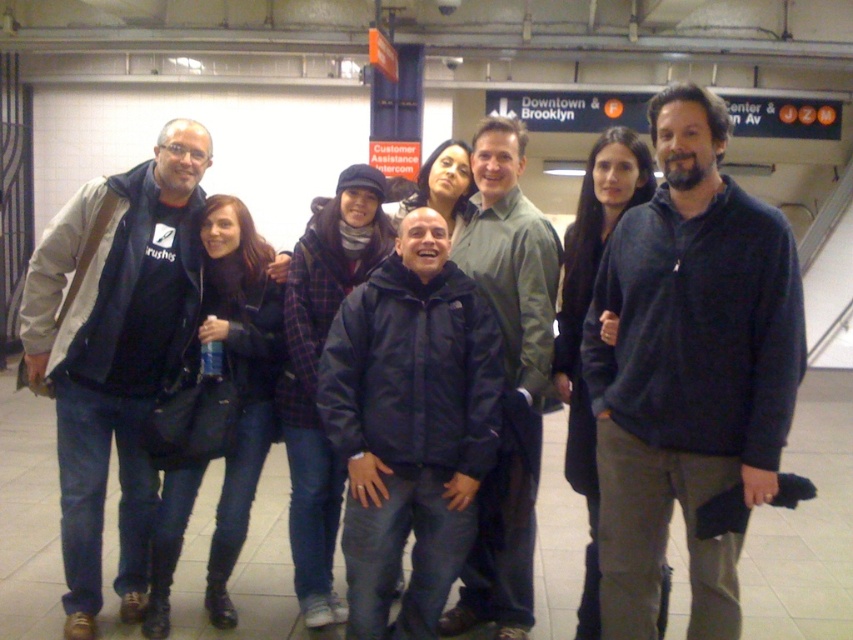
You are a photographer trying to capture a clear shot of both the dark blue fleece at center and the dark blue jacket at center in the subway station. Since you want to ensure both are visible, which one should you focus on first considering their sizes?

The dark blue fleece at center is larger in size than the dark blue jacket at center, so you should focus on the dark blue fleece at center first to ensure it is captured clearly before adjusting for the smaller dark blue jacket at center.

You are standing in the subway station and see the brushed metal jacket at left. Where exactly is it positioned in the image?

The brushed metal jacket at left is positioned at coordinates point (x=115, y=349).

You are a photographer trying to capture a photo of the navy blue jacket at center without the brushed metal jacket at left blocking it. What should you do?

The navy blue jacket at center is behind the brushed metal jacket at left, so you should move to a position where the navy blue jacket at center is no longer obscured by the brushed metal jacket at left.